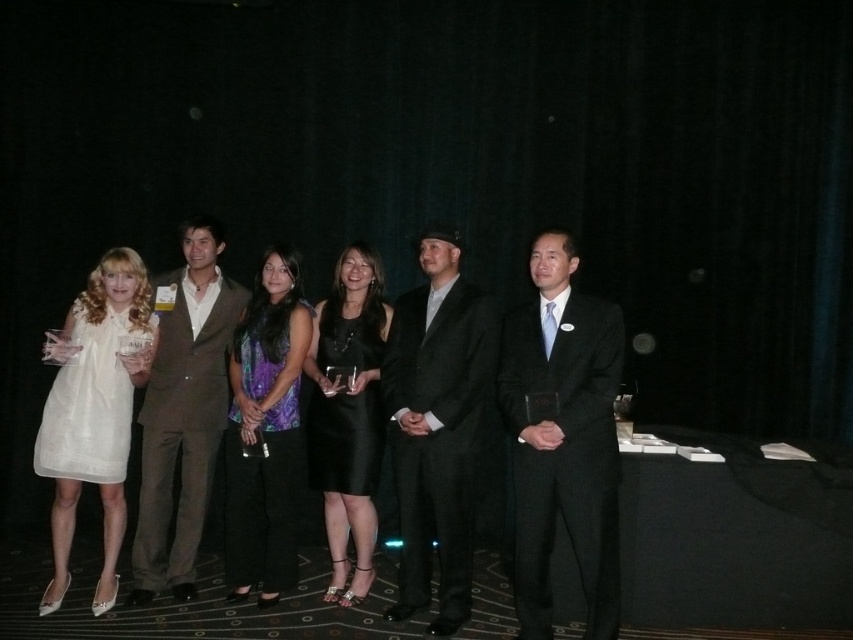
Find the location of `black satin suit at center`. black satin suit at center is located at coordinates (437, 426).

Does black satin suit at center have a lesser width compared to white sheer dress at left?

Indeed, black satin suit at center has a lesser width compared to white sheer dress at left.

Locate an element on the screen. This screenshot has height=640, width=853. black satin suit at center is located at coordinates (437, 426).

Is point (618, 460) positioned behind point (111, 296)?

No, it is in front of (111, 296).

Is black suit at center above white sheer dress at left?

Yes, black suit at center is above white sheer dress at left.

This screenshot has height=640, width=853. I want to click on black suit at center, so click(x=563, y=438).

Between black suit at center and satin black dress at center, which one is positioned higher?

black suit at center is above.

Find the location of a particular element. The image size is (853, 640). black suit at center is located at coordinates (563, 438).